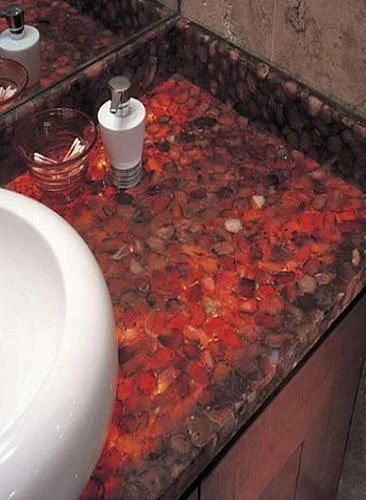
I want to click on bottle, so click(x=117, y=133).